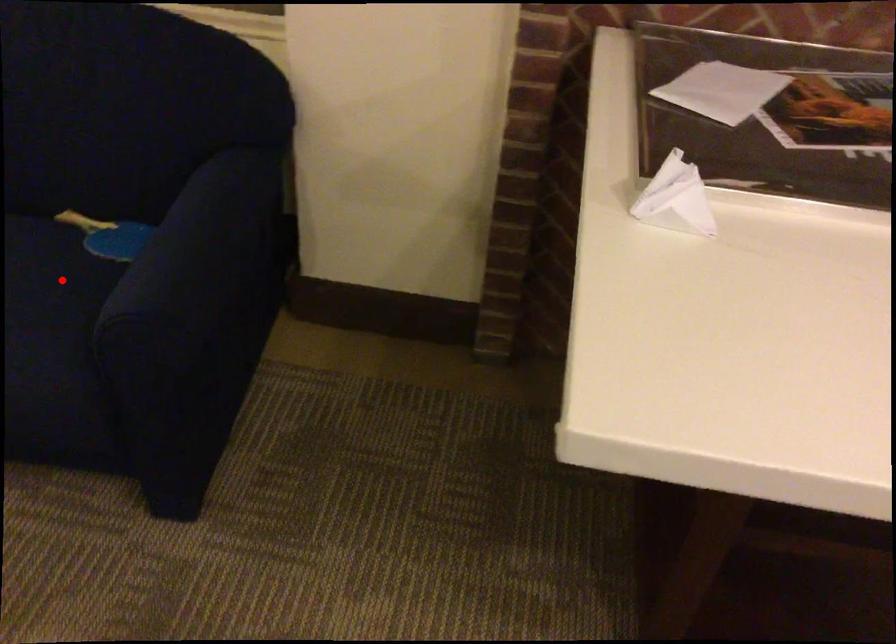
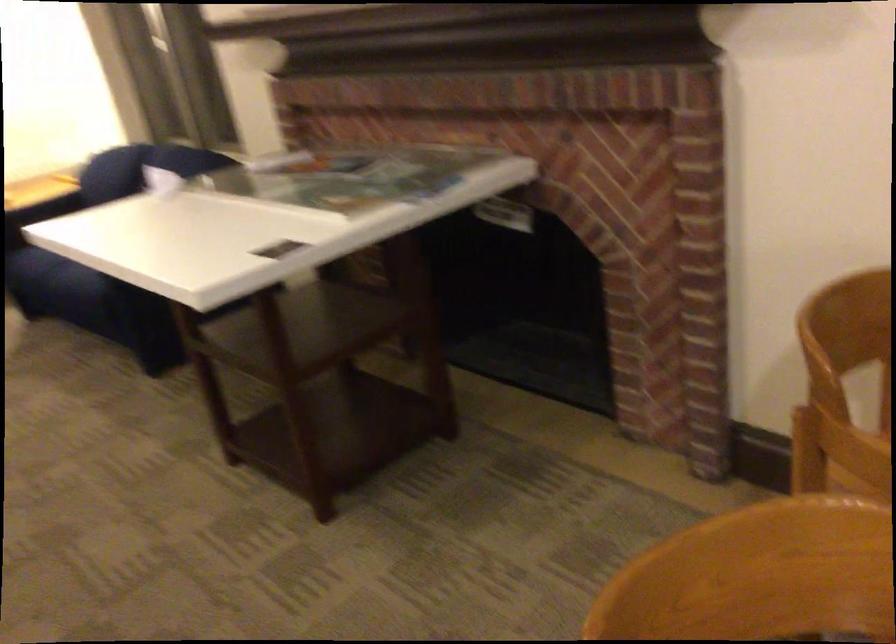
Question: I am providing you with two images of the same scene from different viewpoints. A red point is marked on the first image. Is the red point's position out of view in image 2?

Choices:
 (A) Yes
 (B) No

Answer: (A)